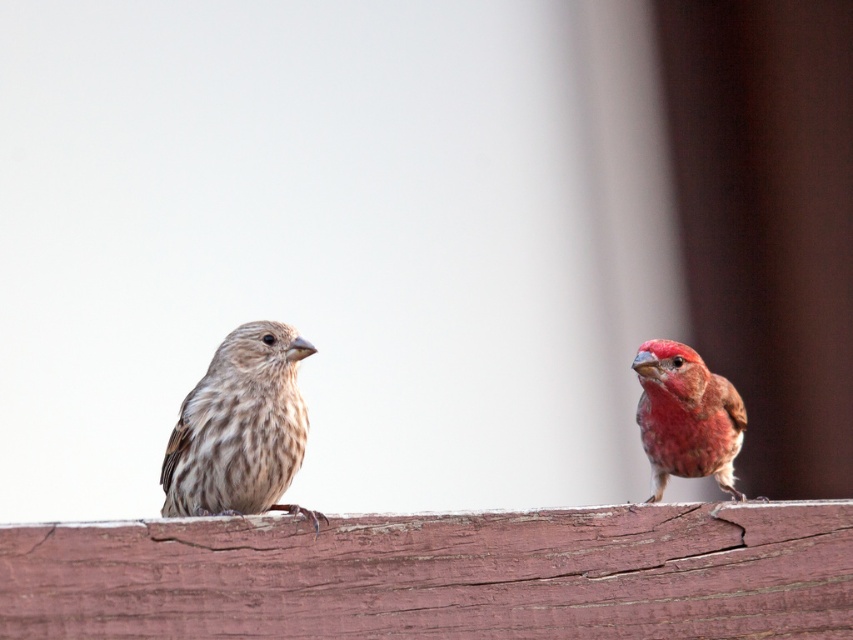
Can you confirm if wooden plank at center is smaller than brown speckled sparrow at left?

Actually, wooden plank at center might be larger than brown speckled sparrow at left.

This screenshot has height=640, width=853. I want to click on wooden plank at center, so click(440, 573).

Is point (474, 554) in front of point (268, 444)?

Yes, point (474, 554) is closer to viewer.

I want to click on wooden plank at center, so click(440, 573).

Based on the photo, can you confirm if brown speckled sparrow at left is positioned below matte pink bird at right?

Yes, brown speckled sparrow at left is below matte pink bird at right.

What do you see at coordinates (241, 428) in the screenshot? The height and width of the screenshot is (640, 853). I see `brown speckled sparrow at left` at bounding box center [241, 428].

The width and height of the screenshot is (853, 640). Find the location of `brown speckled sparrow at left`. brown speckled sparrow at left is located at coordinates (241, 428).

Can you confirm if wooden plank at center is bigger than matte pink bird at right?

Correct, wooden plank at center is larger in size than matte pink bird at right.

Locate an element on the screen. The image size is (853, 640). wooden plank at center is located at coordinates (440, 573).